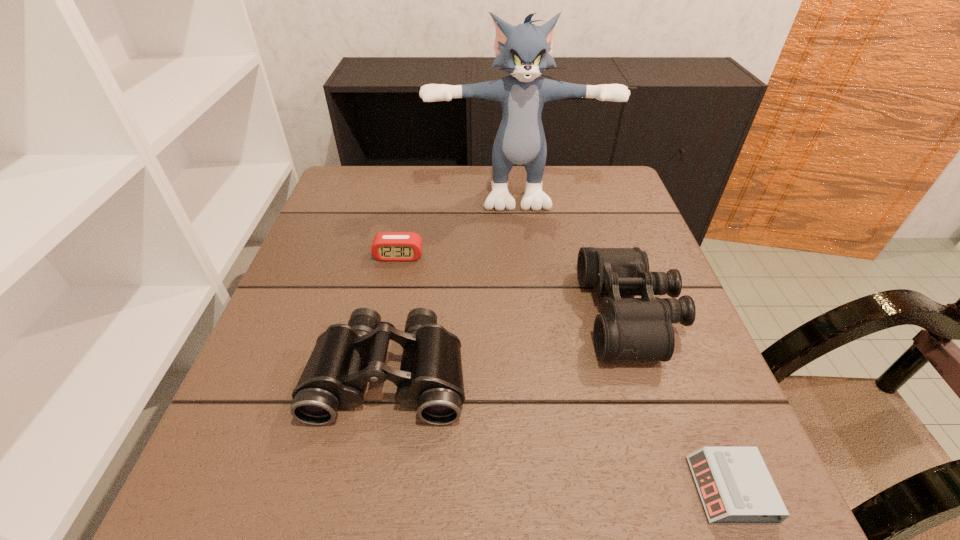
Where is `object that is the closest to the right binoculars`? The height and width of the screenshot is (540, 960). object that is the closest to the right binoculars is located at coordinates (735, 486).

Locate an element on the screen. The image size is (960, 540). vacant space that satisfies the following two spatial constraints: 1. on the front-facing side of the farther alarm clock; 2. on the right side of the shorter alarm clock is located at coordinates (350, 489).

At what (x,y) coordinates should I click in order to perform the action: click on vacant space that satisfies the following two spatial constraints: 1. on the front-facing side of the right alarm clock; 2. on the right side of the cat. Please return your answer as a coordinate pair (x, y). The image size is (960, 540). Looking at the image, I should click on (548, 489).

In order to click on vacant region that satisfies the following two spatial constraints: 1. on the front-facing side of the right alarm clock; 2. on the right side of the left binoculars in this screenshot , I will do `click(369, 489)`.

Identify the location of free spot that satisfies the following two spatial constraints: 1. on the front-facing side of the shortest object; 2. on the left side of the farther alarm clock. (350, 489).

Locate an element on the screen. Image resolution: width=960 pixels, height=540 pixels. vacant point that satisfies the following two spatial constraints: 1. on the front-facing side of the nearer alarm clock; 2. on the right side of the farthest object is located at coordinates (548, 489).

Identify the location of vacant region that satisfies the following two spatial constraints: 1. on the front-facing side of the taller alarm clock; 2. on the left side of the right alarm clock. (350, 489).

Where is `free space that satisfies the following two spatial constraints: 1. on the front-facing side of the nearest object; 2. on the left side of the second farthest object`? The width and height of the screenshot is (960, 540). free space that satisfies the following two spatial constraints: 1. on the front-facing side of the nearest object; 2. on the left side of the second farthest object is located at coordinates (350, 489).

What are the coordinates of `free space that satisfies the following two spatial constraints: 1. at the eyepieces of the right binoculars; 2. on the right side of the shorter alarm clock` in the screenshot? It's located at (688, 489).